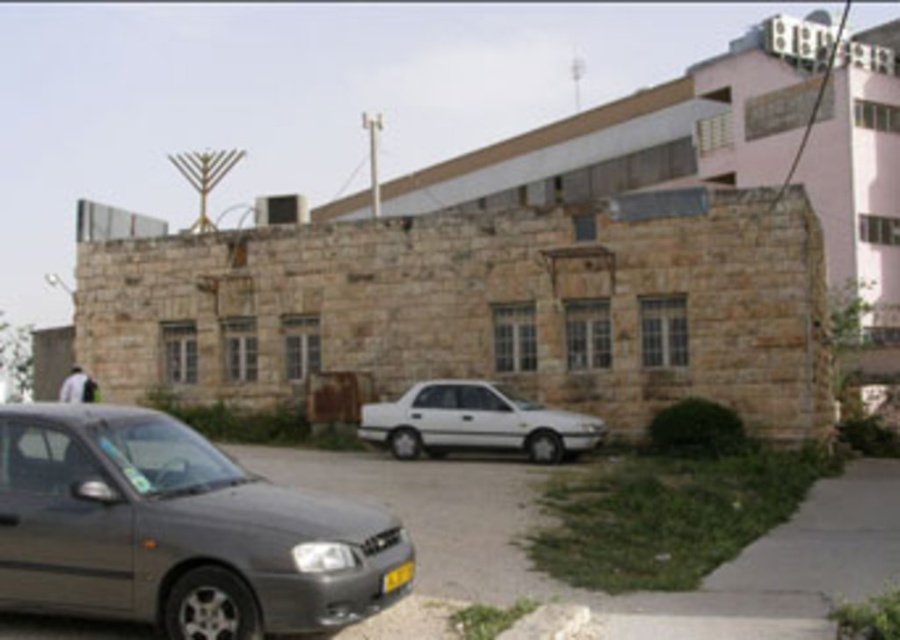
You are a delivery person trying to park your van, which is 1.8 meters tall, in the parking area near the stone building. The parking spot is between the metallic gray sedan at lower left and the white matte sedan at center. Can your van fit there vertically?

The metallic gray sedan at lower left has a lesser height compared to white matte sedan at center. Since the van is 1.8 meters tall, it can fit vertically between them as long as the tallest vehicle in that area, the white matte sedan at center, is not taller than 1.8 meters. However, the description only states the metallic gray sedan is shorter, but does not provide the exact height of the white matte sedan. Without knowing the white matte sedan at center height, it is uncertain if the van can fit.